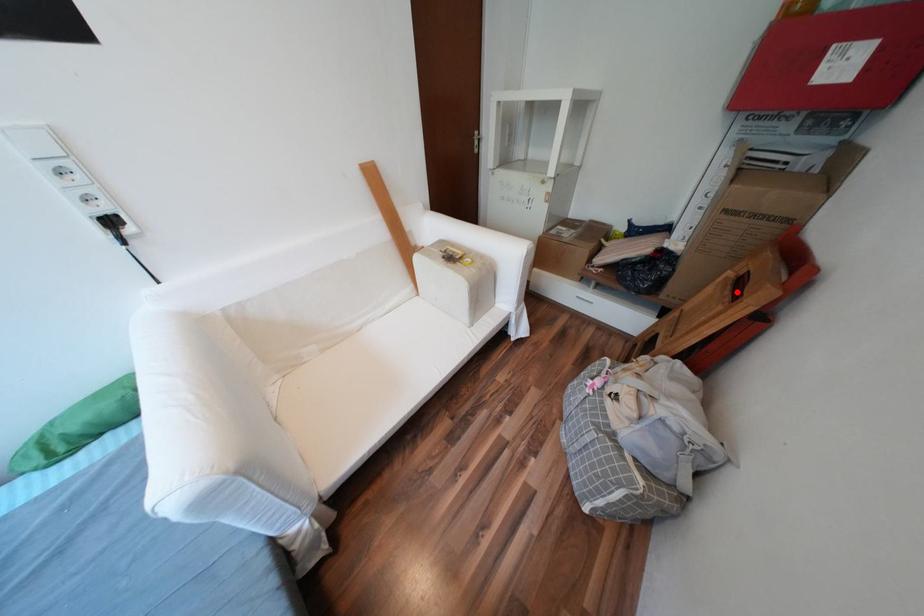
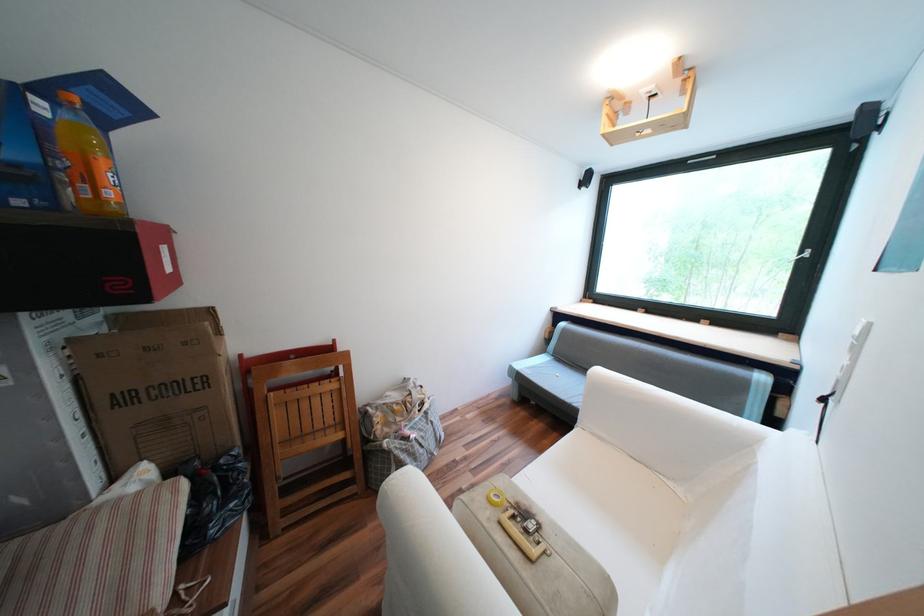
Question: A red point is marked in image1. In image2, is the corresponding 3D point closer to the camera or farther? Reply with the corresponding letter.

Choices:
 (A) The corresponding 3D point is closer.
 (B) The corresponding 3D point is farther.

Answer: (B)